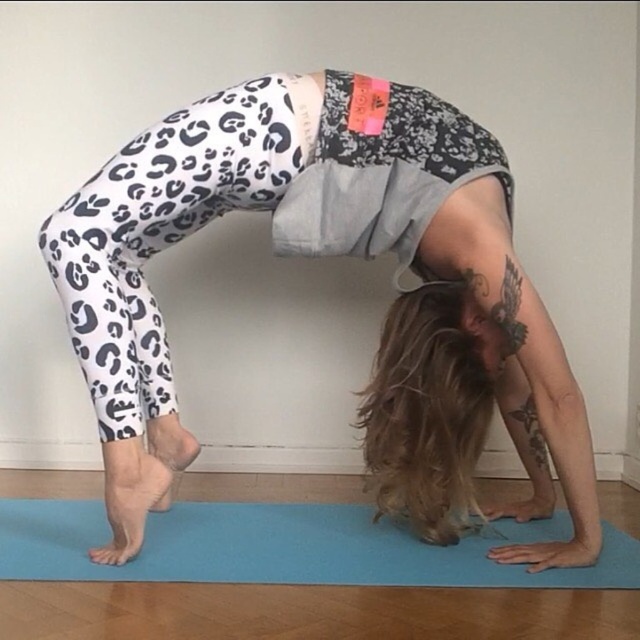
Question: Does white leopard print leggings at center have a larger size compared to blue rubber mat at lower center?

Choices:
 (A) yes
 (B) no

Answer: (A)

Question: Does white leopard print leggings at center have a lesser width compared to blue rubber mat at lower center?

Choices:
 (A) no
 (B) yes

Answer: (B)

Question: Which of the following is the farthest from the observer?

Choices:
 (A) (284, 557)
 (B) (397, 248)

Answer: (B)

Question: Can you confirm if white leopard print leggings at center is positioned below blue rubber mat at lower center?

Choices:
 (A) yes
 (B) no

Answer: (B)

Question: Among these points, which one is nearest to the camera?

Choices:
 (A) (81, 573)
 (B) (381, 353)

Answer: (A)

Question: Which point is farther to the camera?

Choices:
 (A) white leopard print leggings at center
 (B) blue rubber mat at lower center

Answer: (A)